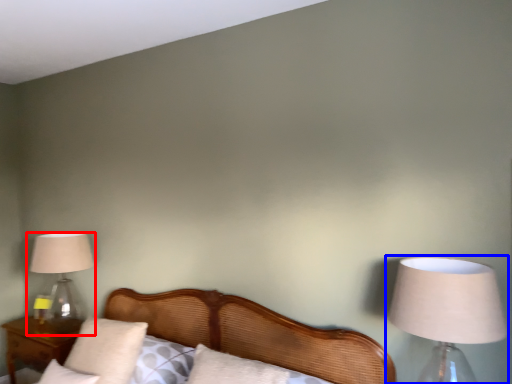
Question: Among these objects, which one is farthest to the camera, lamp (highlighted by a red box) or lamp (highlighted by a blue box)?

Choices:
 (A) lamp
 (B) lamp

Answer: (A)